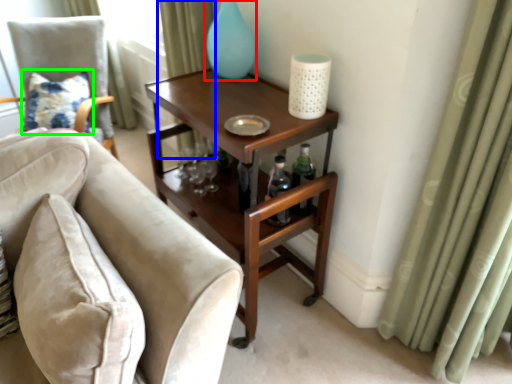
Question: Which object is positioned closest to glass vase (highlighted by a red box)? Select from curtain (highlighted by a blue box) and pillow (highlighted by a green box).

Choices:
 (A) curtain
 (B) pillow

Answer: (A)